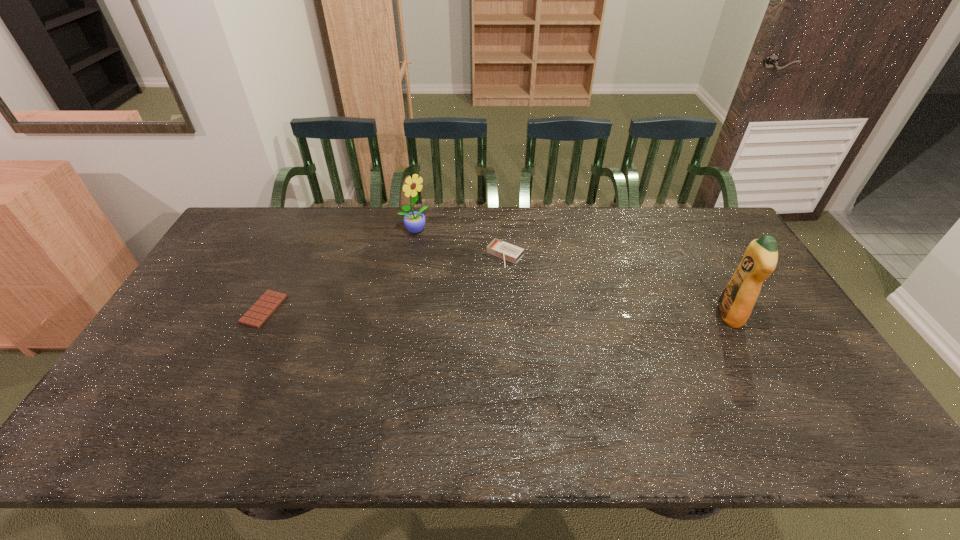
Find the location of a particular element. blank space located on the label of the detergent is located at coordinates (694, 315).

Locate an element on the screen. blank space located 0.330m on the label of the detergent is located at coordinates (604, 315).

You are a GUI agent. You are given a task and a screenshot of the screen. Output one action in this format:
    pyautogui.click(x=<x>, y=<y>)
    Task: Click on the vacant space located 0.240m on the striking surface of the second shortest object
    The width and height of the screenshot is (960, 540).
    Given the screenshot: What is the action you would take?
    pyautogui.click(x=454, y=313)

Find the location of a particular element. vacant space located on the striking surface of the second shortest object is located at coordinates (483, 281).

Where is `free space located on the striking surface of the second shortest object`? The height and width of the screenshot is (540, 960). free space located on the striking surface of the second shortest object is located at coordinates (481, 282).

Identify the location of vacant region located on the front-facing side of the sunflower. This screenshot has height=540, width=960. pos(444,249).

This screenshot has width=960, height=540. What are the coordinates of `blank area located on the front-facing side of the sunflower` in the screenshot? It's located at (468, 266).

Where is `free space located 0.300m on the front-facing side of the sunflower`? This screenshot has width=960, height=540. free space located 0.300m on the front-facing side of the sunflower is located at coordinates (483, 277).

You are a GUI agent. You are given a task and a screenshot of the screen. Output one action in this format:
    pyautogui.click(x=<x>, y=<y>)
    Task: Click on the matchbox that is at the far edge
    
    Given the screenshot: What is the action you would take?
    pyautogui.click(x=504, y=250)

Image resolution: width=960 pixels, height=540 pixels. Identify the location of sunflower present at the far edge. (414, 221).